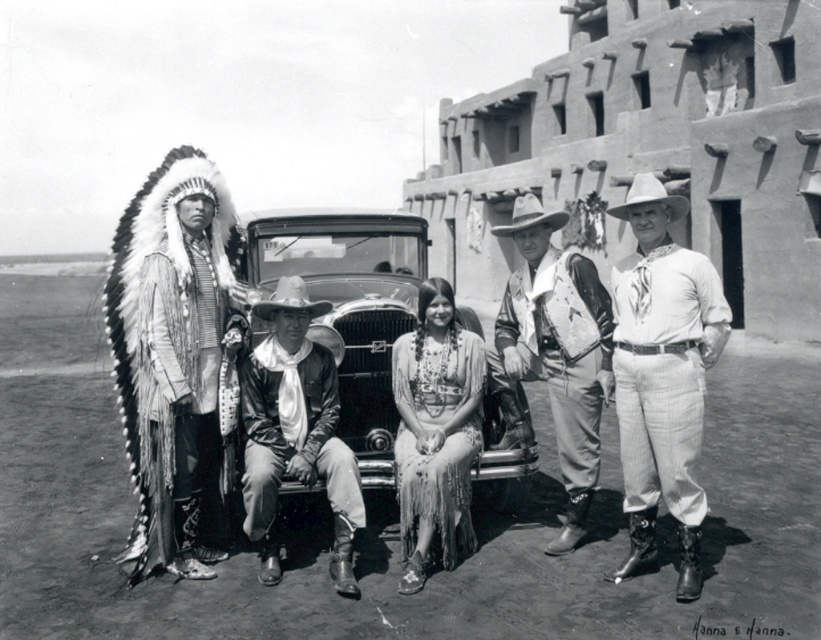
Does leather jacket at center appear over fringed fabric dress at center?

Actually, leather jacket at center is below fringed fabric dress at center.

Is point (255, 474) positioned in front of point (409, 349)?

That is True.

Identify the location of leather jacket at center. The height and width of the screenshot is (640, 821). (296, 429).

Does leather vest at center have a greater width compared to fringed fabric dress at center?

Correct, the width of leather vest at center exceeds that of fringed fabric dress at center.

Who is lower down, leather vest at center or fringed fabric dress at center?

fringed fabric dress at center

The width and height of the screenshot is (821, 640). I want to click on leather vest at center, so click(553, 353).

Does white feathered headdress at left have a lesser height compared to leather vest at center?

Yes, white feathered headdress at left is shorter than leather vest at center.

Does white feathered headdress at left have a larger size compared to leather vest at center?

No, white feathered headdress at left is not bigger than leather vest at center.

Does point (136, 566) come closer to viewer compared to point (534, 352)?

That is True.

The height and width of the screenshot is (640, 821). Identify the location of white feathered headdress at left. (173, 353).